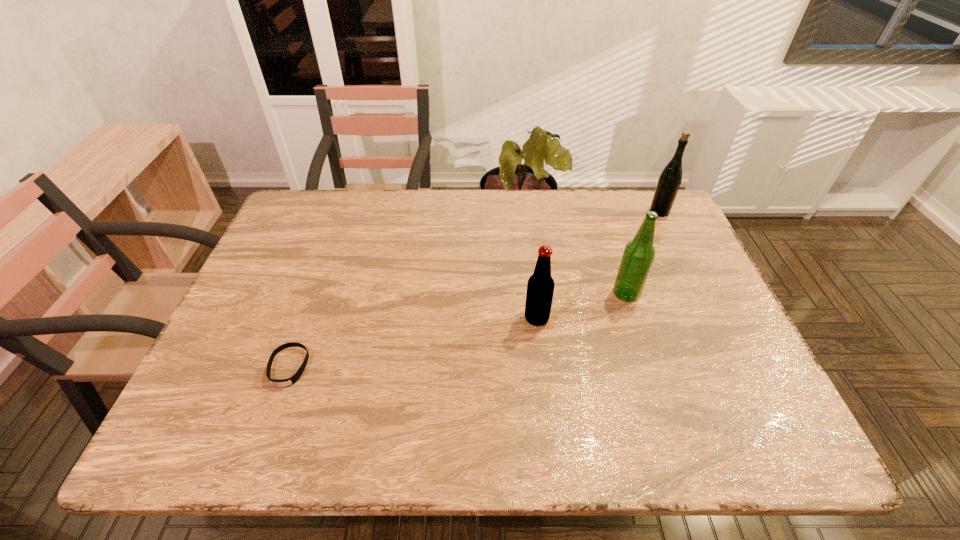
In the image, there is a desktop. Identify the location of blank space at the left edge. Image resolution: width=960 pixels, height=540 pixels. (253, 297).

You are a GUI agent. You are given a task and a screenshot of the screen. Output one action in this format:
    pyautogui.click(x=<x>, y=<y>)
    Task: Click on the vacant space at the right edge of the desktop
    
    Given the screenshot: What is the action you would take?
    pyautogui.click(x=685, y=332)

At what (x,y) coordinates should I click in order to perform the action: click on unoccupied position between the second farthest object and the leftmost beer bottle. Please return your answer as a coordinate pair (x, y). The image size is (960, 540). Looking at the image, I should click on (581, 306).

Where is `vacant space that is in between the rightmost object and the third farthest object`? The image size is (960, 540). vacant space that is in between the rightmost object and the third farthest object is located at coordinates (598, 265).

The height and width of the screenshot is (540, 960). Identify the location of vacant point located between the nearest object and the nearest beer bottle. (413, 342).

The width and height of the screenshot is (960, 540). Find the location of `vacant space that is in between the nearest beer bottle and the second nearest beer bottle`. vacant space that is in between the nearest beer bottle and the second nearest beer bottle is located at coordinates (581, 306).

The height and width of the screenshot is (540, 960). In order to click on free space between the shortest object and the leftmost beer bottle in this screenshot , I will do (413, 342).

You are a GUI agent. You are given a task and a screenshot of the screen. Output one action in this format:
    pyautogui.click(x=<x>, y=<y>)
    Task: Click on the free point between the shortest object and the rightmost object
    
    Given the screenshot: What is the action you would take?
    pyautogui.click(x=474, y=289)

Find the location of a particular element. The width and height of the screenshot is (960, 540). free area in between the nearest object and the rightmost object is located at coordinates (474, 289).

The height and width of the screenshot is (540, 960). In order to click on vacant point located between the second object from left to right and the second farthest beer bottle in this screenshot , I will do coord(581,306).